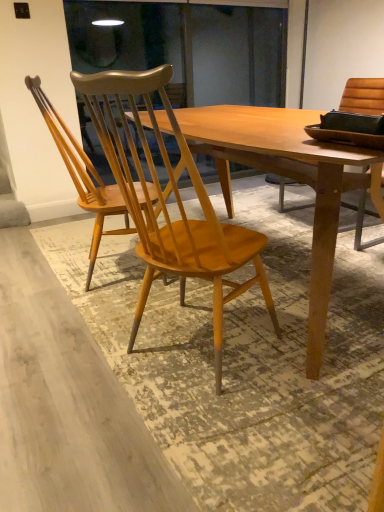
You are a GUI agent. You are given a task and a screenshot of the screen. Output one action in this format:
    pyautogui.click(x=<x>, y=<y>)
    Task: Click on the light brown wood chair at center, which is counted as the second chair, starting from the right
    The height and width of the screenshot is (512, 384).
    Given the screenshot: What is the action you would take?
    point(82,176)

This screenshot has width=384, height=512. What do you see at coordinates (82, 176) in the screenshot?
I see `light brown wood chair at center, which is counted as the second chair, starting from the right` at bounding box center [82, 176].

Measure the distance between light brown wood chair at center, which is counted as the second chair, starting from the right, and camera.

They are 1.85 meters apart.

How much space does light brown wood chair at center, which is counted as the second chair, starting from the right, occupy horizontally?

light brown wood chair at center, which is counted as the second chair, starting from the right, is 17.76 inches wide.

Measure the distance between light brown wood chair at center, the 1th chair viewed from the right, and camera.

A distance of 97.00 centimeters exists between light brown wood chair at center, the 1th chair viewed from the right, and camera.

You are a GUI agent. You are given a task and a screenshot of the screen. Output one action in this format:
    pyautogui.click(x=<x>, y=<y>)
    Task: Click on the light brown wood chair at center, the 2th chair when ordered from left to right
    
    Given the screenshot: What is the action you would take?
    pyautogui.click(x=176, y=201)

What do you see at coordinates (176, 201) in the screenshot? This screenshot has width=384, height=512. I see `light brown wood chair at center, the 1th chair viewed from the right` at bounding box center [176, 201].

The width and height of the screenshot is (384, 512). I want to click on light brown wood chair at center, which is counted as the second chair, starting from the right, so click(82, 176).

Based on their positions, is light brown wood chair at center, the 2th chair when ordered from left to right, located to the left or right of light brown wood chair at center, which ranks as the first chair in left-to-right order?

light brown wood chair at center, the 2th chair when ordered from left to right, is positioned on light brown wood chair at center, which ranks as the first chair in left-to-right order,'s right side.

Is the depth of light brown wood chair at center, the 1th chair viewed from the right, less than that of light brown wood chair at center, which is counted as the second chair, starting from the right?

Yes, light brown wood chair at center, the 1th chair viewed from the right, is in front of light brown wood chair at center, which is counted as the second chair, starting from the right.

Which is more distant, (136,86) or (85,181)?

The point (85,181) is more distant.

From the image's perspective, is light brown wood chair at center, the 2th chair when ordered from left to right, below light brown wood chair at center, which ranks as the first chair in left-to-right order?

Yes, from the image's perspective, light brown wood chair at center, the 2th chair when ordered from left to right, is beneath light brown wood chair at center, which ranks as the first chair in left-to-right order.

From a real-world perspective, which object stands above the other?

From a 3D spatial view, light brown wood chair at center, which ranks as the first chair in left-to-right order, is above.

Which of these two, light brown wood chair at center, the 2th chair when ordered from left to right, or light brown wood chair at center, which ranks as the first chair in left-to-right order, is wider?

light brown wood chair at center, the 2th chair when ordered from left to right, is wider.

Can you confirm if light brown wood chair at center, the 2th chair when ordered from left to right, is shorter than light brown wood chair at center, which is counted as the second chair, starting from the right?

Incorrect, the height of light brown wood chair at center, the 2th chair when ordered from left to right, does not fall short of that of light brown wood chair at center, which is counted as the second chair, starting from the right.

Looking at the image, does light brown wood chair at center, the 2th chair when ordered from left to right, seem bigger or smaller compared to light brown wood chair at center, which ranks as the first chair in left-to-right order?

Considering their sizes, light brown wood chair at center, the 2th chair when ordered from left to right, takes up more space than light brown wood chair at center, which ranks as the first chair in left-to-right order.

Would you say light brown wood chair at center, the 2th chair when ordered from left to right, is inside or outside light brown wood chair at center, which is counted as the second chair, starting from the right?

light brown wood chair at center, the 2th chair when ordered from left to right, is outside light brown wood chair at center, which is counted as the second chair, starting from the right.

Looking at this image, is light brown wood chair at center, the 1th chair viewed from the right, next to light brown wood chair at center, which ranks as the first chair in left-to-right order, and touching it?

No, light brown wood chair at center, the 1th chair viewed from the right, is not next to light brown wood chair at center, which ranks as the first chair in left-to-right order.

Is light brown wood chair at center, the 1th chair viewed from the right, oriented away from light brown wood chair at center, which is counted as the second chair, starting from the right?

No.

In the scene shown: How different are the orientations of light brown wood chair at center, the 1th chair viewed from the right, and light brown wood chair at center, which is counted as the second chair, starting from the right, in degrees?

35.4 degrees.

How distant is light brown wood chair at center, the 2th chair when ordered from left to right, from light brown wood chair at center, which ranks as the first chair in left-to-right order?

66.07 centimeters.

Where is `chair that is above the light brown wood chair at center, the 1th chair viewed from the right (from a real-world perspective)`? This screenshot has width=384, height=512. chair that is above the light brown wood chair at center, the 1th chair viewed from the right (from a real-world perspective) is located at coordinates (82, 176).

Can you confirm if light brown wood chair at center, which is counted as the second chair, starting from the right, is positioned to the left of light brown wood chair at center, the 2th chair when ordered from left to right?

Yes, light brown wood chair at center, which is counted as the second chair, starting from the right, is to the left of light brown wood chair at center, the 2th chair when ordered from left to right.

Is light brown wood chair at center, which is counted as the second chair, starting from the right, in front of or behind light brown wood chair at center, the 2th chair when ordered from left to right, in the image?

Clearly, light brown wood chair at center, which is counted as the second chair, starting from the right, is behind light brown wood chair at center, the 2th chair when ordered from left to right.

Is point (67, 155) closer to camera compared to point (214, 303)?

No, (67, 155) is behind (214, 303).

From the image's perspective, which is above, light brown wood chair at center, which is counted as the second chair, starting from the right, or light brown wood chair at center, the 2th chair when ordered from left to right?

light brown wood chair at center, which is counted as the second chair, starting from the right.

From a real-world perspective, is light brown wood chair at center, which is counted as the second chair, starting from the right, above or below light brown wood chair at center, the 2th chair when ordered from left to right?

Clearly, from a real-world perspective, light brown wood chair at center, which is counted as the second chair, starting from the right, is above light brown wood chair at center, the 2th chair when ordered from left to right.

Is light brown wood chair at center, which is counted as the second chair, starting from the right, thinner than light brown wood chair at center, the 1th chair viewed from the right?

Yes.

Considering the relative sizes of light brown wood chair at center, which is counted as the second chair, starting from the right, and light brown wood chair at center, the 1th chair viewed from the right, in the image provided, is light brown wood chair at center, which is counted as the second chair, starting from the right, taller than light brown wood chair at center, the 1th chair viewed from the right,?

No.

Which of these two, light brown wood chair at center, which is counted as the second chair, starting from the right, or light brown wood chair at center, the 2th chair when ordered from left to right, is smaller?

Result: light brown wood chair at center, which is counted as the second chair, starting from the right.

Would you say light brown wood chair at center, which ranks as the first chair in left-to-right order, is outside light brown wood chair at center, the 2th chair when ordered from left to right?

Absolutely, light brown wood chair at center, which ranks as the first chair in left-to-right order, is external to light brown wood chair at center, the 2th chair when ordered from left to right.

Is light brown wood chair at center, which is counted as the second chair, starting from the right, beside light brown wood chair at center, the 1th chair viewed from the right?

There is a gap between light brown wood chair at center, which is counted as the second chair, starting from the right, and light brown wood chair at center, the 1th chair viewed from the right.

Is light brown wood chair at center, which ranks as the first chair in left-to-right order, looking in the opposite direction of light brown wood chair at center, the 2th chair when ordered from left to right?

light brown wood chair at center, which ranks as the first chair in left-to-right order, is not turned away from light brown wood chair at center, the 2th chair when ordered from left to right.

Based on the photo, could you measure the distance between light brown wood chair at center, which ranks as the first chair in left-to-right order, and light brown wood chair at center, the 1th chair viewed from the right?

A distance of 66.07 centimeters exists between light brown wood chair at center, which ranks as the first chair in left-to-right order, and light brown wood chair at center, the 1th chair viewed from the right.

Find the location of a particular element. This screenshot has height=512, width=384. chair below the light brown wood chair at center, which ranks as the first chair in left-to-right order (from the image's perspective) is located at coordinates (176, 201).

Locate an element on the screen. The width and height of the screenshot is (384, 512). chair to the left of light brown wood chair at center, the 1th chair viewed from the right is located at coordinates (82, 176).

Where is `chair lying below the light brown wood chair at center, which is counted as the second chair, starting from the right (from the image's perspective)`? The image size is (384, 512). chair lying below the light brown wood chair at center, which is counted as the second chair, starting from the right (from the image's perspective) is located at coordinates (176, 201).